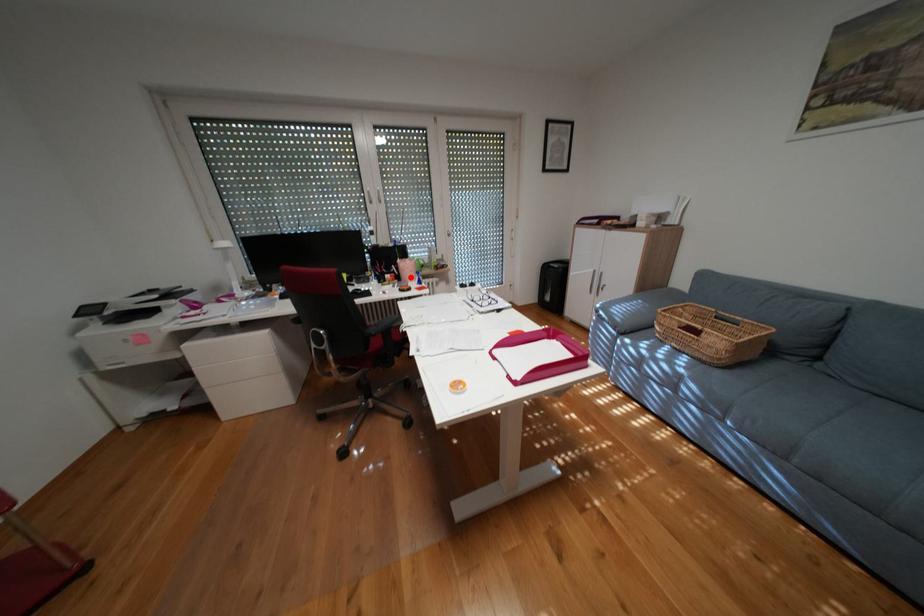
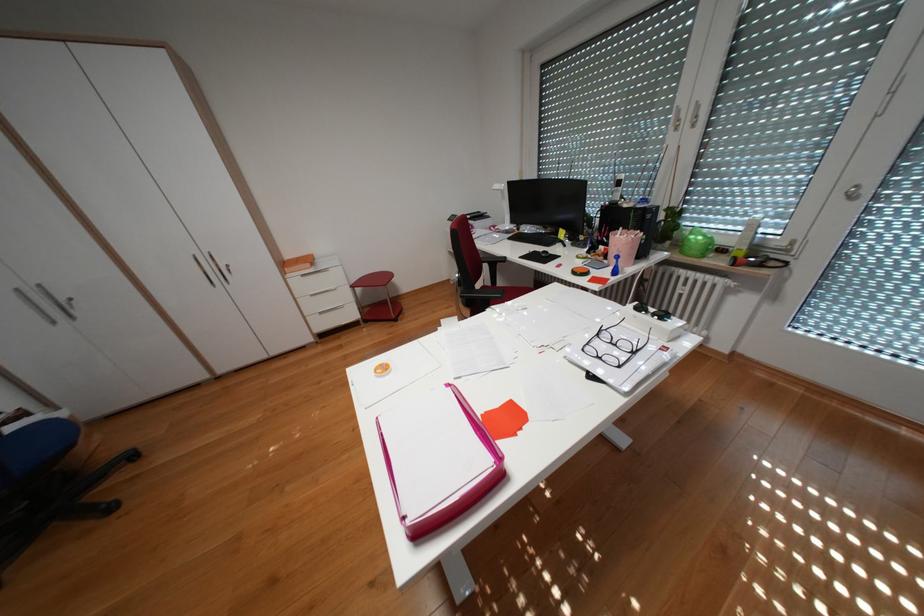
The point at the highlighted location is marked in the first image. Where is the corresponding point in the second image?

(618, 254)